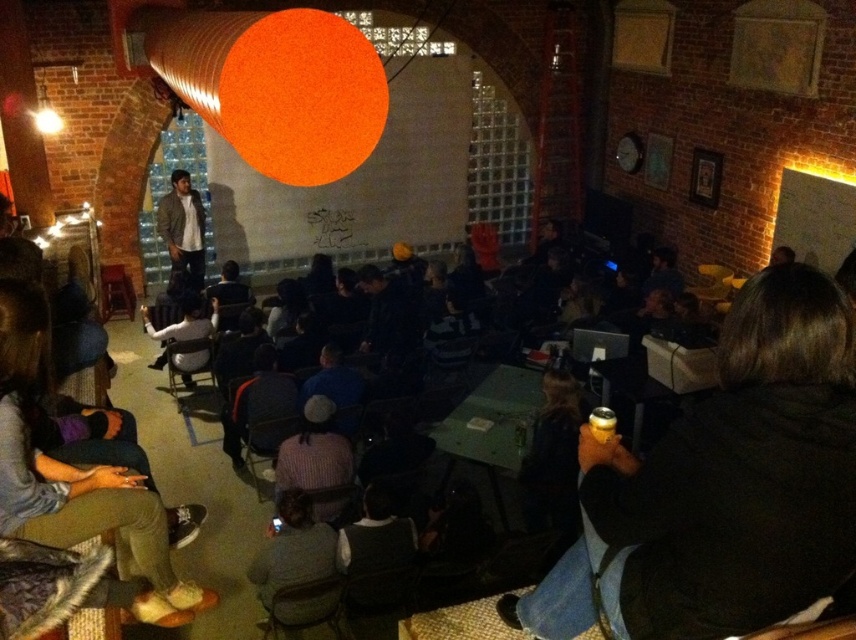
Between denim jacket at lower left and light brown leather jacket at center, which one has less height?

denim jacket at lower left

Does denim jacket at lower left have a greater width compared to light brown leather jacket at center?

Yes, denim jacket at lower left is wider than light brown leather jacket at center.

Is point (60, 484) positioned in front of point (188, 260)?

Yes, point (60, 484) is in front of point (188, 260).

Identify the location of denim jacket at lower left. (74, 474).

Who is more forward, (800, 264) or (185, 236)?

Point (800, 264)

Can you confirm if black matte jacket at lower right is thinner than light brown leather jacket at center?

No.

The image size is (856, 640). Describe the element at coordinates (740, 474) in the screenshot. I see `black matte jacket at lower right` at that location.

At what (x,y) coordinates should I click in order to perform the action: click on black matte jacket at lower right. Please return your answer as a coordinate pair (x, y). Looking at the image, I should click on (740, 474).

Which is more to the left, black matte jacket at lower right or denim jacket at lower left?

denim jacket at lower left is more to the left.

Who is taller, black matte jacket at lower right or denim jacket at lower left?

denim jacket at lower left

Is point (625, 577) farther from camera compared to point (25, 288)?

No, it is in front of (25, 288).

This screenshot has height=640, width=856. I want to click on black matte jacket at lower right, so click(740, 474).